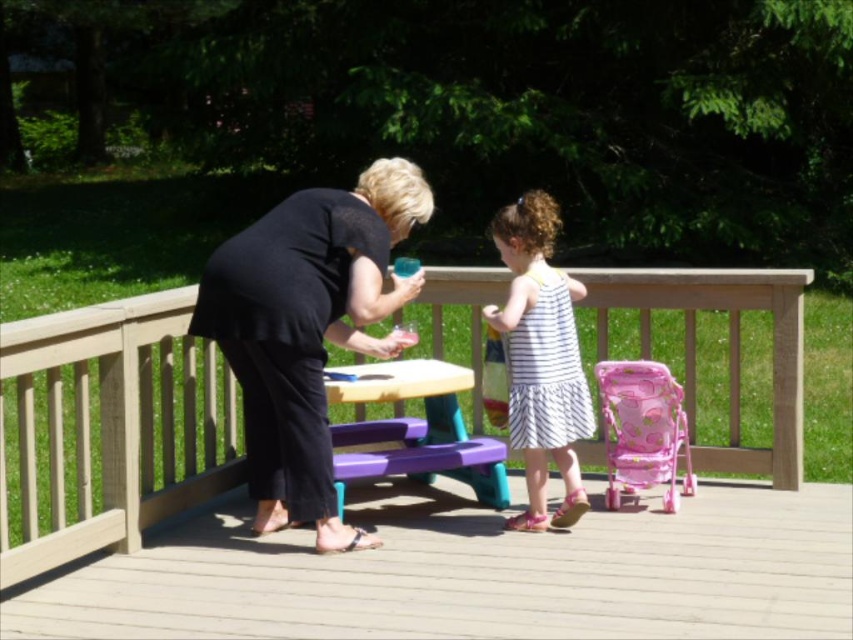
You are standing on the wooden deck and see the wooden picnic table at center and the black matte dress at center. Which object is located to the right of the other?

The wooden picnic table at center is positioned on the right side of black matte dress at center, so the wooden picnic table at center is to the right of the black matte dress at center.

You are a parent standing on the wooden deck and want to move the pink fabric baby carriage at right to the left side of the wooden picnic table at center. Is this possible without moving the picnic table?

The wooden picnic table at center is positioned over the pink fabric baby carriage at right, so you cannot move the carriage without first moving the picnic table.